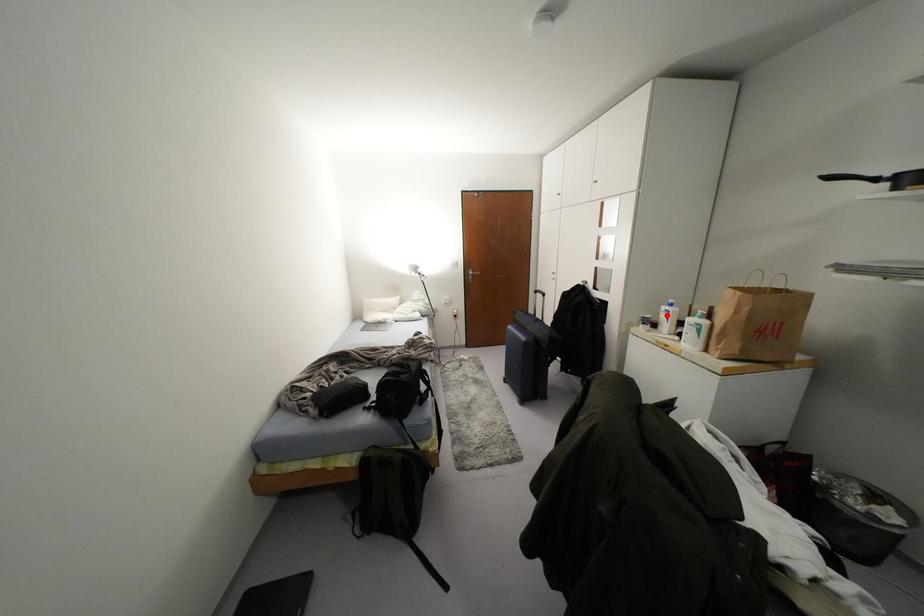
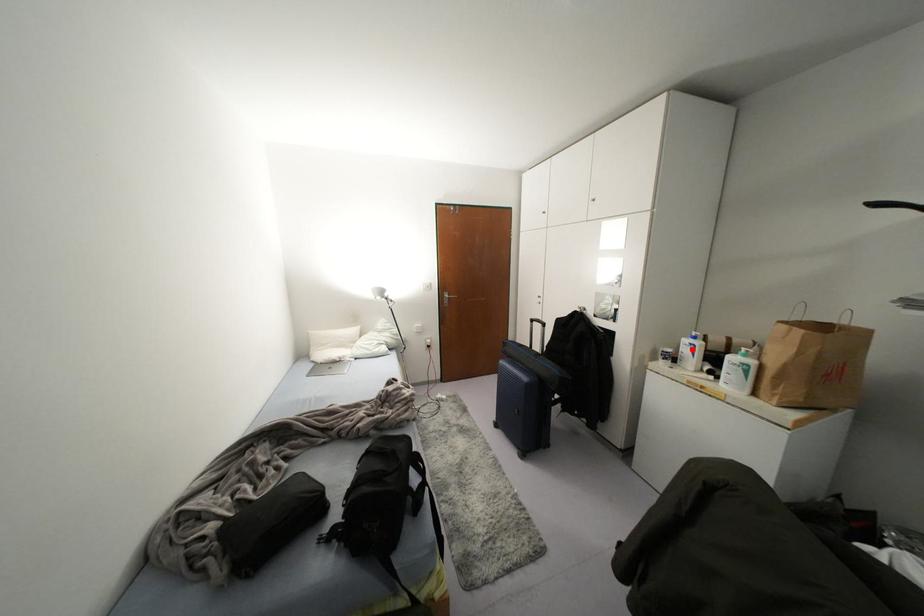
I am providing you with two images of the same scene from different viewpoints. A red point is marked on the first image and another point is marked on the second image. Do the highlighted points in image1 and image2 indicate the same real-world spot?

Yes